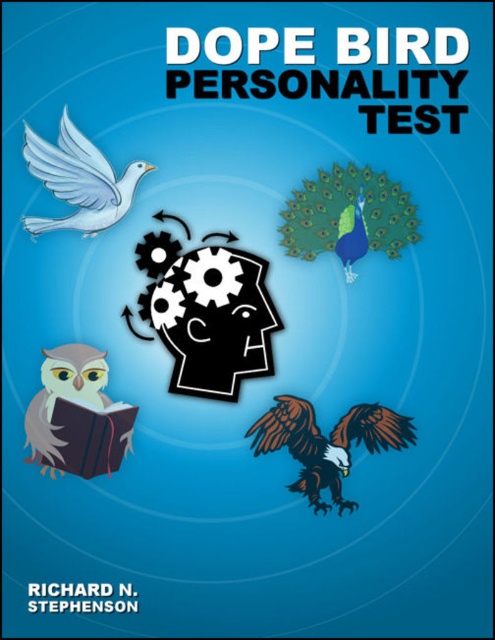
Question: In this image, where is white matte dove at upper left located relative to hardcover book at lower left?

Choices:
 (A) below
 (B) above

Answer: (B)

Question: Can you confirm if white matte dove at upper left is positioned to the left of hardcover book at lower left?

Choices:
 (A) no
 (B) yes

Answer: (B)

Question: Does white matte dove at upper left have a smaller size compared to hardcover book at lower left?

Choices:
 (A) no
 (B) yes

Answer: (A)

Question: Which point is closer to the camera?

Choices:
 (A) (79, 147)
 (B) (110, 452)

Answer: (A)

Question: Which point appears farthest from the camera in this image?

Choices:
 (A) (38, 154)
 (B) (75, 460)

Answer: (B)